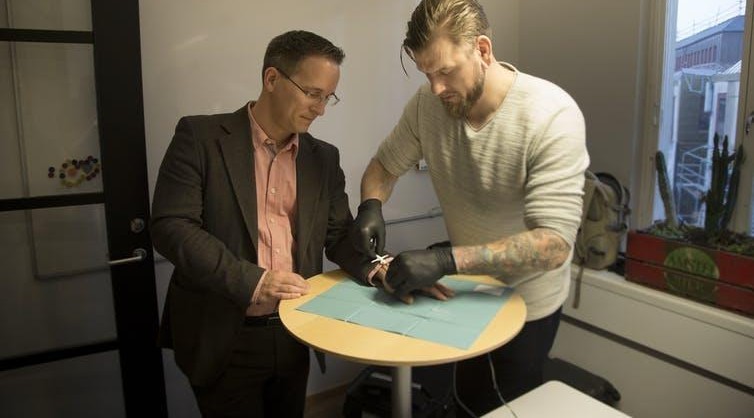
Image resolution: width=754 pixels, height=418 pixels. Find the location of `sheet`. sheet is located at coordinates (375, 315).